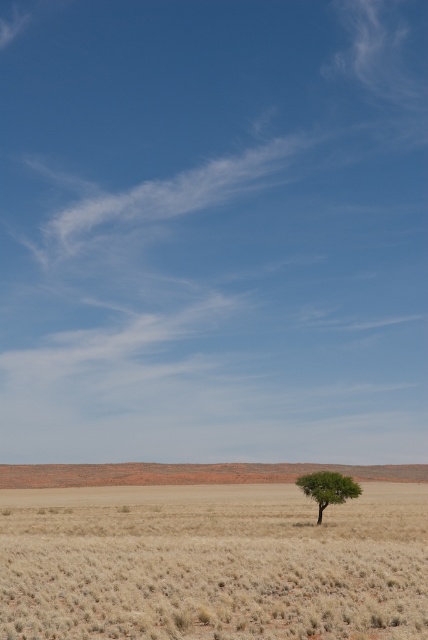
Question: Which point is closer to the camera?

Choices:
 (A) dry grass at center
 (B) green leafy tree at center

Answer: (A)

Question: Does dry grass at center have a larger size compared to green leafy tree at center?

Choices:
 (A) yes
 (B) no

Answer: (A)

Question: Is dry grass at center bigger than green leafy tree at center?

Choices:
 (A) no
 (B) yes

Answer: (B)

Question: Is dry grass at center above green leafy tree at center?

Choices:
 (A) yes
 (B) no

Answer: (B)

Question: Which point is closer to the camera taking this photo?

Choices:
 (A) (345, 563)
 (B) (342, 500)

Answer: (A)